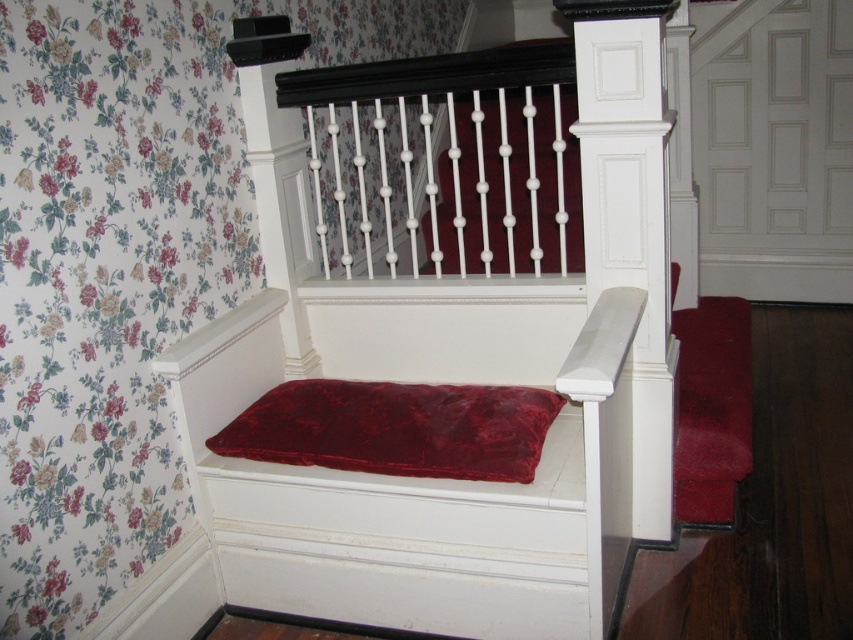
Question: Which point is farther to the camera?

Choices:
 (A) (456, 444)
 (B) (299, 506)

Answer: (B)

Question: Is velvet cushion at center further to the viewer compared to velvet red pillow at center?

Choices:
 (A) no
 (B) yes

Answer: (A)

Question: Among these points, which one is farthest from the camera?

Choices:
 (A) (219, 547)
 (B) (508, 472)

Answer: (A)

Question: In this image, where is velvet cushion at center located relative to velvet red pillow at center?

Choices:
 (A) right
 (B) left

Answer: (A)

Question: Does velvet cushion at center appear on the left side of velvet red pillow at center?

Choices:
 (A) no
 (B) yes

Answer: (A)

Question: Among these objects, which one is farthest from the camera?

Choices:
 (A) velvet cushion at center
 (B) velvet red pillow at center

Answer: (B)